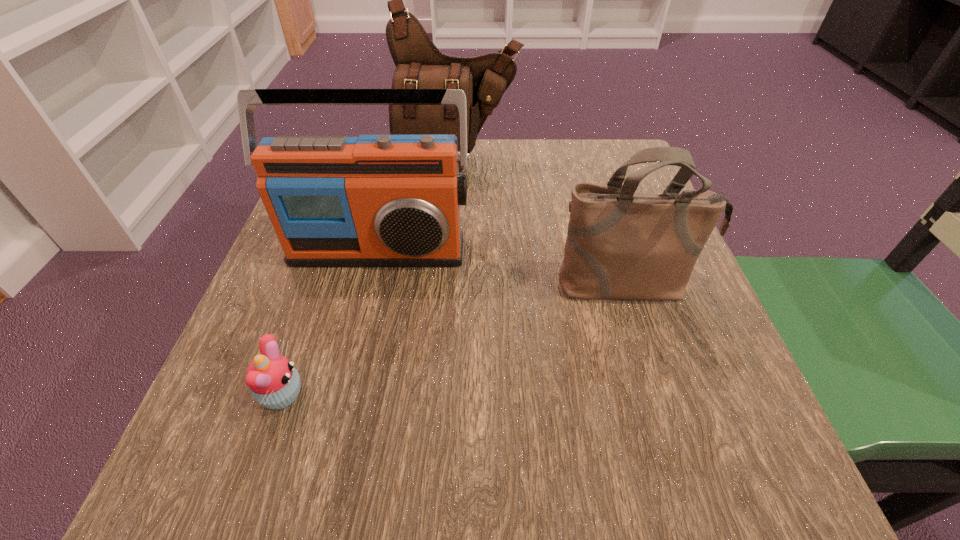
I want to click on vacant region located 0.320m on the face of the cupcake, so click(527, 395).

Locate an element on the screen. The width and height of the screenshot is (960, 540). object at the far edge is located at coordinates (419, 64).

Image resolution: width=960 pixels, height=540 pixels. I want to click on radio receiver located at the left edge, so pos(375,200).

What are the coordinates of `cupcake situated at the left edge` in the screenshot? It's located at (274, 382).

At what (x,y) coordinates should I click in order to perform the action: click on object present at the right edge. Please return your answer as a coordinate pair (x, y). This screenshot has width=960, height=540. Looking at the image, I should click on pyautogui.click(x=620, y=244).

Where is `vacant region at the far edge of the desktop`? vacant region at the far edge of the desktop is located at coordinates (491, 167).

In the image, there is a desktop. Where is `free space at the left edge`? The image size is (960, 540). free space at the left edge is located at coordinates (327, 334).

In the image, there is a desktop. Where is `free space at the right edge`? The height and width of the screenshot is (540, 960). free space at the right edge is located at coordinates coord(765,433).

Locate an element on the screen. This screenshot has height=540, width=960. blank area at the far right corner is located at coordinates (585, 173).

Locate an element on the screen. vacant space at the near right corner of the desktop is located at coordinates (660, 462).